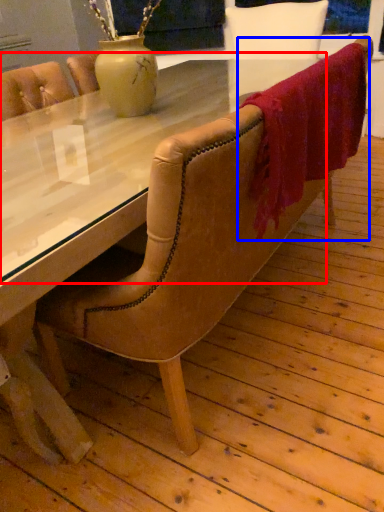
Question: Among these objects, which one is farthest to the camera, glass table (highlighted by a red box) or blanket (highlighted by a blue box)?

Choices:
 (A) glass table
 (B) blanket

Answer: (B)